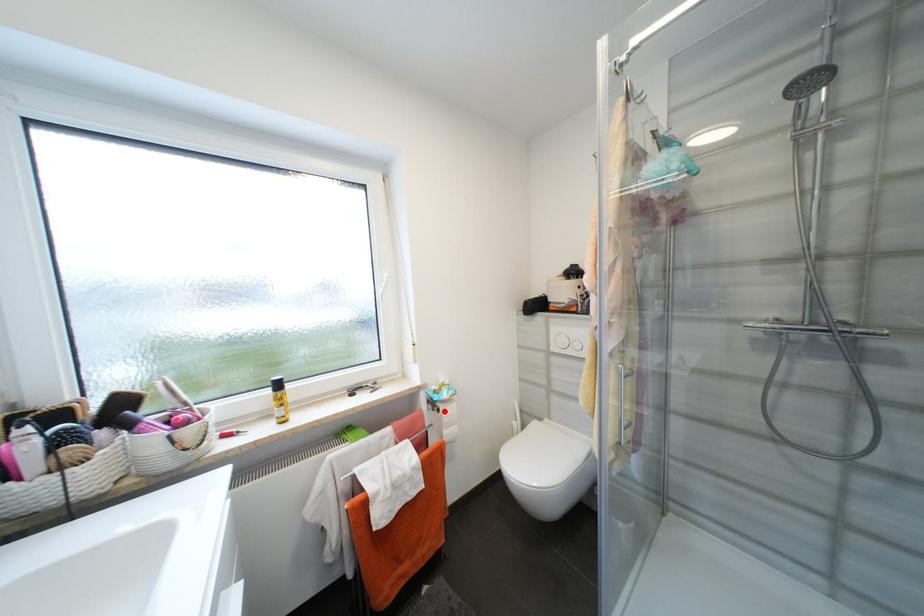
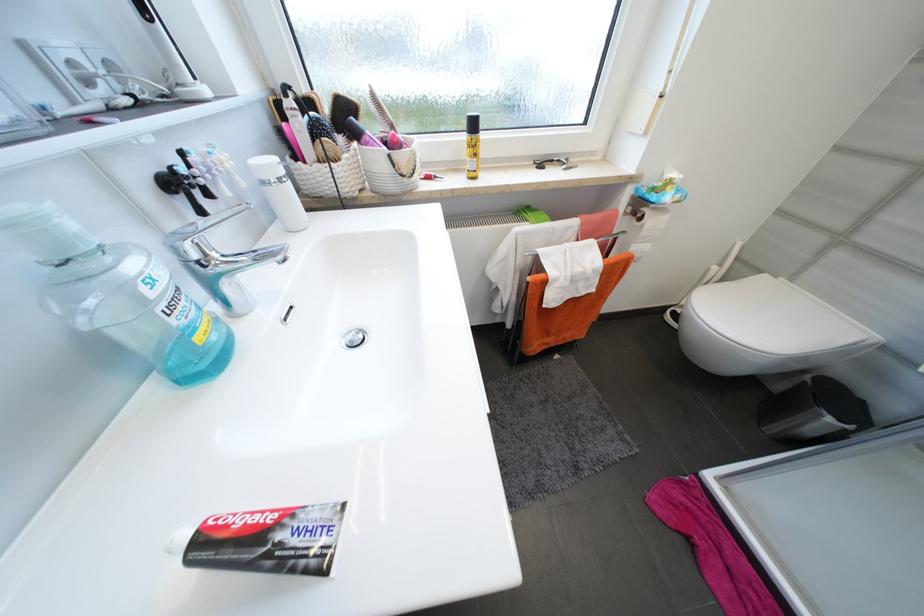
Question: I am providing you with two images of the same scene from different viewpoints. In image1, a red point is highlighted. Considering the same 3D point in image2, which of the following is correct?

Choices:
 (A) It is closer
 (B) It is farther

Answer: (A)